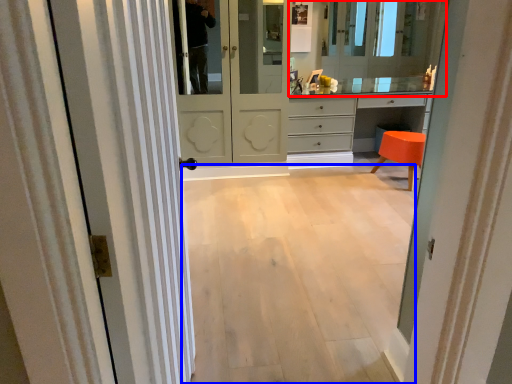
Question: Which object appears closest to the camera in this image, mirror (highlighted by a red box) or corridor (highlighted by a blue box)?

Choices:
 (A) mirror
 (B) corridor

Answer: (B)